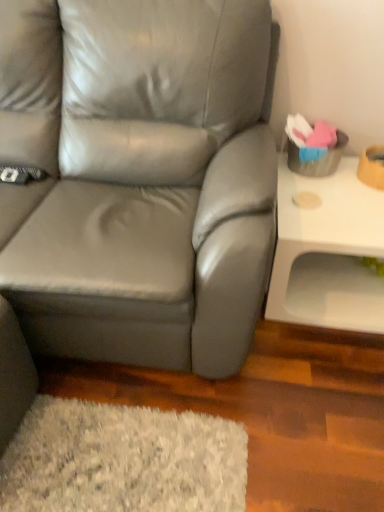
Question: Considering the relative positions of matte gray leather couch at center and white glossy table at right in the image provided, is matte gray leather couch at center in front of white glossy table at right?

Choices:
 (A) no
 (B) yes

Answer: (B)

Question: Considering the relative sizes of matte gray leather couch at center and white glossy table at right in the image provided, is matte gray leather couch at center wider than white glossy table at right?

Choices:
 (A) yes
 (B) no

Answer: (A)

Question: Can you confirm if matte gray leather couch at center is taller than white glossy table at right?

Choices:
 (A) no
 (B) yes

Answer: (B)

Question: From the image's perspective, is matte gray leather couch at center above white glossy table at right?

Choices:
 (A) no
 (B) yes

Answer: (B)

Question: Is matte gray leather couch at center bigger than white glossy table at right?

Choices:
 (A) no
 (B) yes

Answer: (B)

Question: Is matte gray leather couch at center far from white glossy table at right?

Choices:
 (A) yes
 (B) no

Answer: (B)

Question: Is there a large distance between white glossy table at right and matte gray leather couch at center?

Choices:
 (A) yes
 (B) no

Answer: (B)

Question: Could you tell me if white glossy table at right is turned towards matte gray leather couch at center?

Choices:
 (A) yes
 (B) no

Answer: (B)

Question: Is white glossy table at right thinner than matte gray leather couch at center?

Choices:
 (A) yes
 (B) no

Answer: (A)

Question: Considering the relative sizes of white glossy table at right and matte gray leather couch at center in the image provided, is white glossy table at right smaller than matte gray leather couch at center?

Choices:
 (A) no
 (B) yes

Answer: (B)

Question: Is white glossy table at right at the left side of matte gray leather couch at center?

Choices:
 (A) yes
 (B) no

Answer: (B)

Question: Does white glossy table at right have a lesser height compared to matte gray leather couch at center?

Choices:
 (A) yes
 (B) no

Answer: (A)

Question: Considering their positions, is matte gray leather couch at center located in front of or behind white glossy table at right?

Choices:
 (A) behind
 (B) front

Answer: (B)